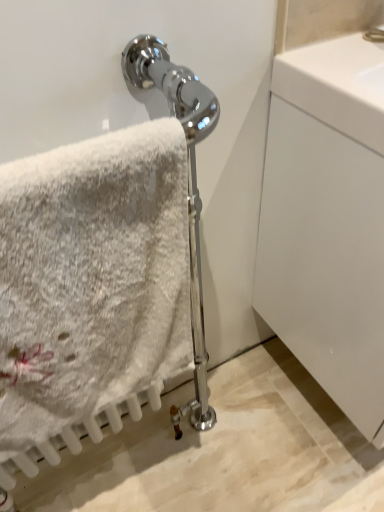
The image size is (384, 512). I want to click on white fluffy towel at left, so click(x=91, y=278).

Image resolution: width=384 pixels, height=512 pixels. What do you see at coordinates (91, 278) in the screenshot?
I see `white fluffy towel at left` at bounding box center [91, 278].

Find the location of `white glossy cabinet at right`. white glossy cabinet at right is located at coordinates (325, 259).

What do you see at coordinates (325, 259) in the screenshot? The height and width of the screenshot is (512, 384). I see `white glossy cabinet at right` at bounding box center [325, 259].

What is the approximate width of white glossy cabinet at right?

It is 19.15 inches.

In order to face white glossy cabinet at right, should I rotate leftwards or rightwards?

You should look right and rotate roughly 28.293 degrees.

The height and width of the screenshot is (512, 384). I want to click on white fluffy towel at left, so click(x=91, y=278).

Considering the relative positions of white fluffy towel at left and white glossy cabinet at right in the image provided, is white fluffy towel at left to the left of white glossy cabinet at right from the viewer's perspective?

Yes, white fluffy towel at left is to the left of white glossy cabinet at right.

Relative to white glossy cabinet at right, is white fluffy towel at left in front or behind?

white fluffy towel at left is positioned closer to the viewer than white glossy cabinet at right.

Is point (125, 306) positioned after point (334, 255)?

That is False.

From the image's perspective, which is above, white fluffy towel at left or white glossy cabinet at right?

white glossy cabinet at right.

From a real-world perspective, is white fluffy towel at left above or below white glossy cabinet at right?

Clearly, from a real-world perspective, white fluffy towel at left is above white glossy cabinet at right.

Is white fluffy towel at left thinner than white glossy cabinet at right?

Yes, white fluffy towel at left is thinner than white glossy cabinet at right.

Can you confirm if white fluffy towel at left is shorter than white glossy cabinet at right?

Indeed, white fluffy towel at left has a lesser height compared to white glossy cabinet at right.

Looking at the image, does white fluffy towel at left seem bigger or smaller compared to white glossy cabinet at right?

Considering their sizes, white fluffy towel at left takes up less space than white glossy cabinet at right.

Can white glossy cabinet at right be found inside white fluffy towel at left?

No.

Are white fluffy towel at left and white glossy cabinet at right located far from each other?

No, white fluffy towel at left is not far from white glossy cabinet at right.

Is white fluffy towel at left oriented away from white glossy cabinet at right?

No, white fluffy towel at left is not facing away from white glossy cabinet at right.

Locate an element on the screen. The height and width of the screenshot is (512, 384). glass door that appears behind the white fluffy towel at left is located at coordinates (325, 259).

Does white glossy cabinet at right appear on the right side of white fluffy towel at left?

Correct, you'll find white glossy cabinet at right to the right of white fluffy towel at left.

In the scene shown: Considering the positions of objects white glossy cabinet at right and white fluffy towel at left in the image provided, who is in front, white glossy cabinet at right or white fluffy towel at left?

white fluffy towel at left.

Is point (259, 256) behind point (180, 269)?

Yes.

From the image's perspective, which object appears higher, white glossy cabinet at right or white fluffy towel at left?

white glossy cabinet at right appears higher in the image.

From a real-world perspective, is white glossy cabinet at right positioned above or below white fluffy towel at left?

white glossy cabinet at right is situated lower than white fluffy towel at left in the real world.

Considering the sizes of objects white glossy cabinet at right and white fluffy towel at left in the image provided, who is thinner, white glossy cabinet at right or white fluffy towel at left?

With smaller width is white fluffy towel at left.

Can you confirm if white glossy cabinet at right is shorter than white fluffy towel at left?

Incorrect, the height of white glossy cabinet at right does not fall short of that of white fluffy towel at left.

Can you confirm if white glossy cabinet at right is bigger than white fluffy towel at left?

Correct, white glossy cabinet at right is larger in size than white fluffy towel at left.

Is white fluffy towel at left completely or partially inside white glossy cabinet at right?

No, white fluffy towel at left is located outside of white glossy cabinet at right.

Would you say white glossy cabinet at right is a long distance from white fluffy towel at left?

No, white glossy cabinet at right is not far from white fluffy towel at left.

Is white glossy cabinet at right oriented away from white fluffy towel at left?

No, white fluffy towel at left is not at the back of white glossy cabinet at right.

In order to click on towel positioned vertically above the white glossy cabinet at right (from a real-world perspective) in this screenshot , I will do `click(91, 278)`.

The width and height of the screenshot is (384, 512). In the image, there is a white fluffy towel at left. Find the location of `glass door below it (from a real-world perspective)`. glass door below it (from a real-world perspective) is located at coordinates (325, 259).

Find the location of `glass door above the white fluffy towel at left (from the image's perspective)`. glass door above the white fluffy towel at left (from the image's perspective) is located at coordinates (325, 259).